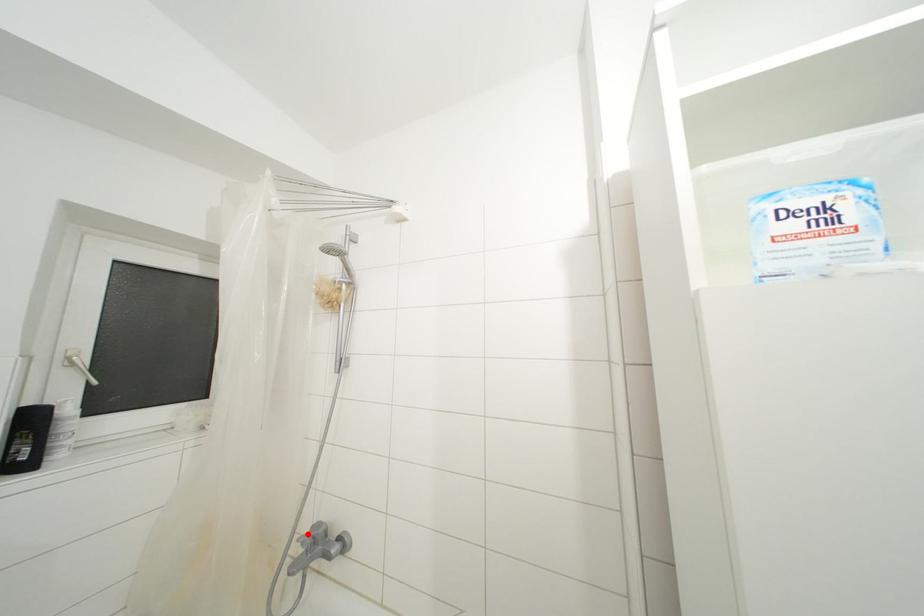
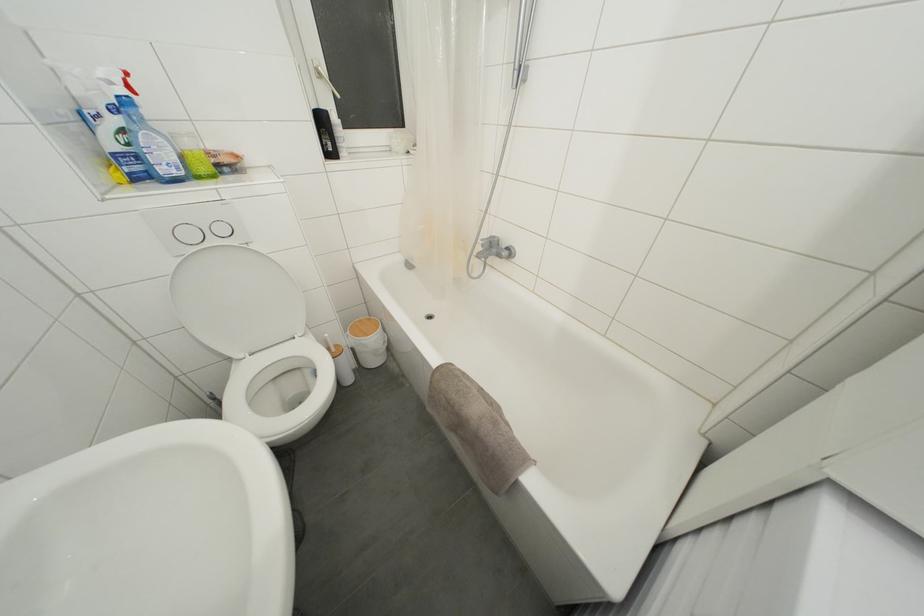
Question: I am providing you with two images of the same scene from different viewpoints. A red point is marked on the first image. At the location where the point appears in image 1, is it still visible in image 2?

Choices:
 (A) Yes
 (B) No

Answer: (A)